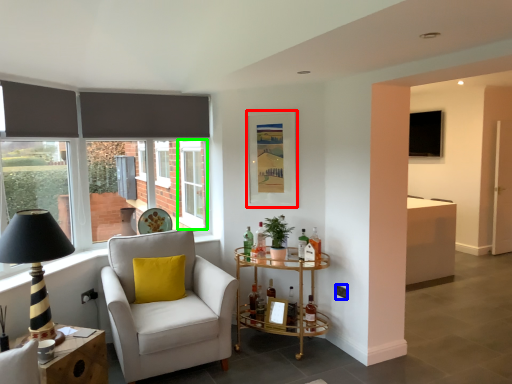
Question: Considering the real-world distances, which object is closest to picture frame (highlighted by a red box)? power outlet (highlighted by a blue box) or window frame (highlighted by a green box).

Choices:
 (A) power outlet
 (B) window frame

Answer: (A)